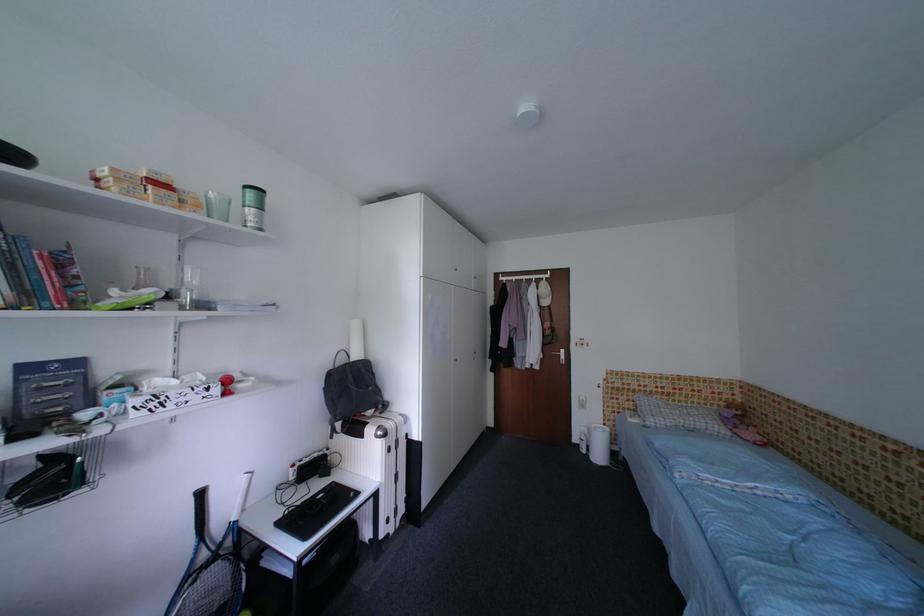
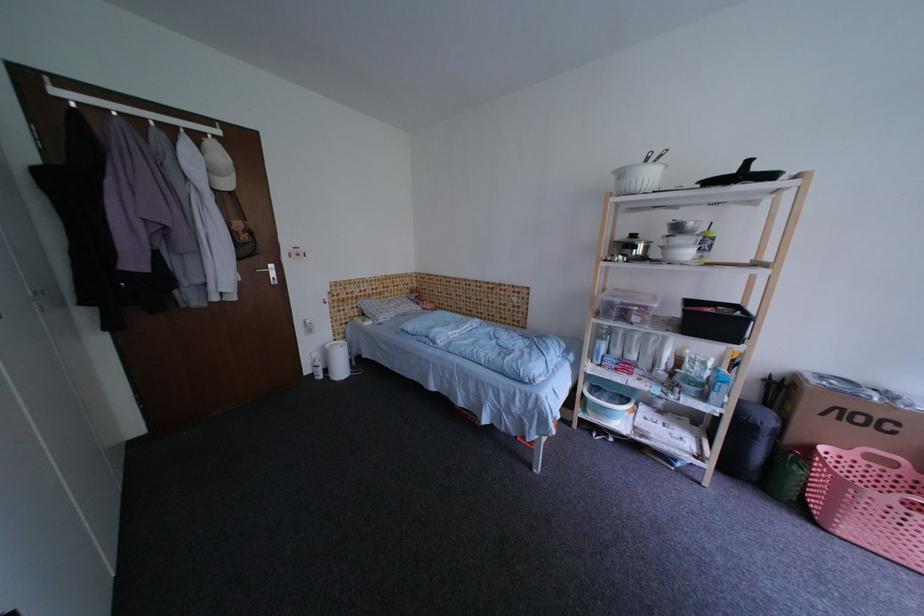
In the second image, find the point that corresponds to pixel 553 291 in the first image.

(227, 158)